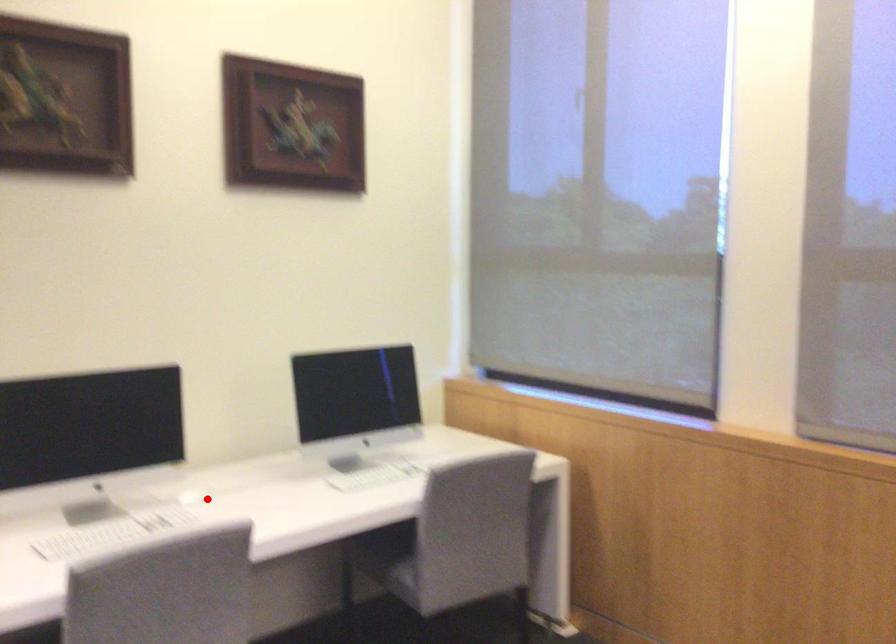
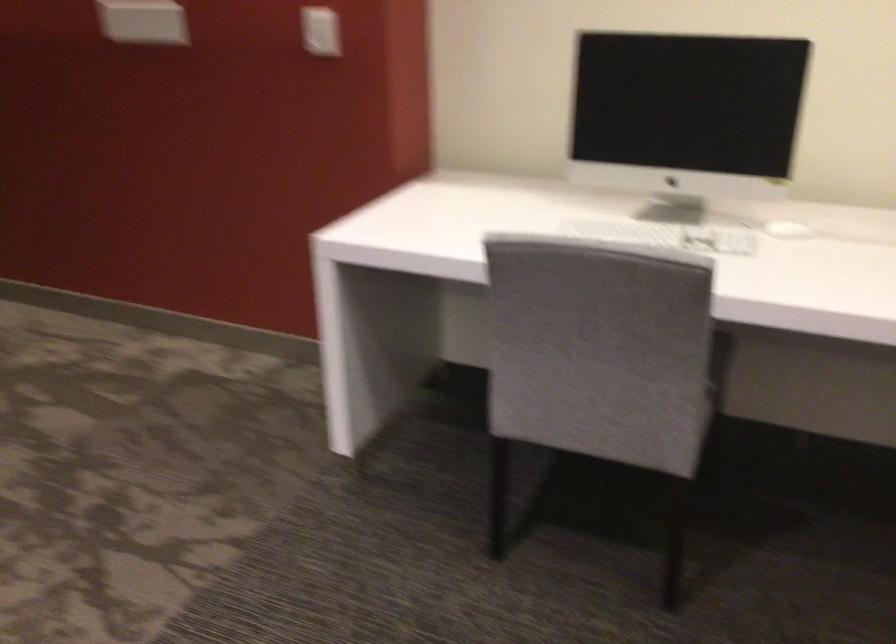
Question: I am providing you with two images of the same scene from different viewpoints. A red point is shown in image1. For the corresponding object point in image2, is it positioned nearer or farther from the camera?

Choices:
 (A) Nearer
 (B) Farther

Answer: (A)